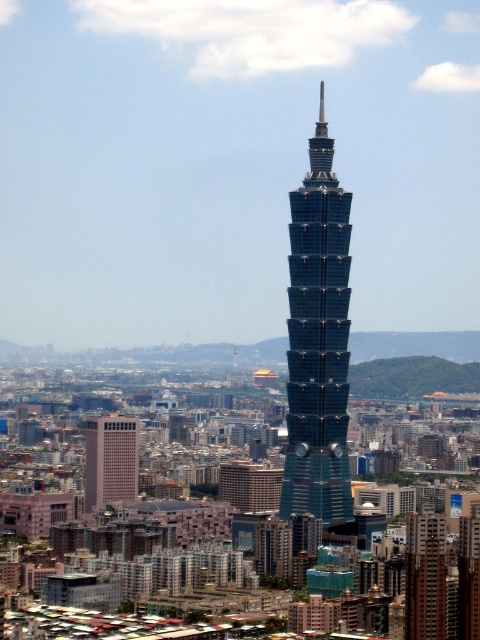
Question: Is shiny glass skyscraper at center positioned at the back of green glass skyscraper at center?

Choices:
 (A) no
 (B) yes

Answer: (A)

Question: Can you confirm if shiny glass skyscraper at center is positioned to the left of green glass skyscraper at center?

Choices:
 (A) no
 (B) yes

Answer: (B)

Question: Which object is positioned farthest from the shiny glass skyscraper at center?

Choices:
 (A) beige brick building at lower left
 (B) green glass skyscraper at center

Answer: (A)

Question: Which of these objects is positioned farthest from the shiny glass skyscraper at center?

Choices:
 (A) beige brick building at lower left
 (B) green glass skyscraper at center

Answer: (A)

Question: Which object is the farthest from the shiny glass skyscraper at center?

Choices:
 (A) green glass skyscraper at center
 (B) beige brick building at lower left

Answer: (B)

Question: From the image, what is the correct spatial relationship of green glass skyscraper at center in relation to beige brick building at lower left?

Choices:
 (A) left
 (B) right

Answer: (B)